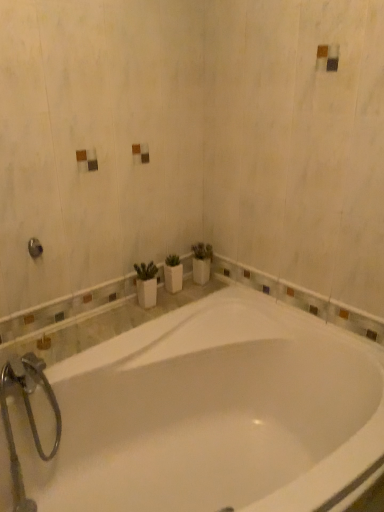
The image size is (384, 512). What do you see at coordinates (35, 248) in the screenshot?
I see `brushed metal shower at upper left` at bounding box center [35, 248].

Measure the distance between brushed metal shower at upper left and camera.

A distance of 1.55 meters exists between brushed metal shower at upper left and camera.

Image resolution: width=384 pixels, height=512 pixels. What are the coordinates of `brushed metal shower at upper left` in the screenshot? It's located at (35, 248).

Describe the element at coordinates (210, 413) in the screenshot. I see `white glossy bathtub at center` at that location.

At what (x,y) coordinates should I click in order to perform the action: click on white glossy bathtub at center. Please return your answer as a coordinate pair (x, y). This screenshot has width=384, height=512. Looking at the image, I should click on (210, 413).

In order to click on brushed metal shower at upper left in this screenshot , I will do `click(35, 248)`.

Consider the image. Considering the positions of objects white glossy bathtub at center and brushed metal shower at upper left in the image provided, who is more to the left, white glossy bathtub at center or brushed metal shower at upper left?

From the viewer's perspective, brushed metal shower at upper left appears more on the left side.

Does white glossy bathtub at center lie behind brushed metal shower at upper left?

No.

Between point (383, 403) and point (33, 256), which one is positioned in front?

The point (383, 403) is in front.

From the image's perspective, is white glossy bathtub at center located above brushed metal shower at upper left?

No, from the image's perspective, white glossy bathtub at center is not above brushed metal shower at upper left.

From a real-world perspective, is white glossy bathtub at center physically located above or below brushed metal shower at upper left?

white glossy bathtub at center is situated lower than brushed metal shower at upper left in the real world.

Between white glossy bathtub at center and brushed metal shower at upper left, which one has smaller width?

brushed metal shower at upper left.

Based on the photo, considering the sizes of white glossy bathtub at center and brushed metal shower at upper left in the image, is white glossy bathtub at center taller or shorter than brushed metal shower at upper left?

Clearly, white glossy bathtub at center is taller compared to brushed metal shower at upper left.

Can you confirm if white glossy bathtub at center is bigger than brushed metal shower at upper left?

Yes.

Can we say white glossy bathtub at center lies outside brushed metal shower at upper left?

Yes, white glossy bathtub at center is not within brushed metal shower at upper left.

From the picture: Is white glossy bathtub at center next to brushed metal shower at upper left?

No, white glossy bathtub at center is not next to brushed metal shower at upper left.

Is white glossy bathtub at center positioned with its back to brushed metal shower at upper left?

No, brushed metal shower at upper left is not at the back of white glossy bathtub at center.

This screenshot has height=512, width=384. Find the location of `bathtub that is in front of the brushed metal shower at upper left`. bathtub that is in front of the brushed metal shower at upper left is located at coordinates (210, 413).

Looking at this image, which is more to the right, brushed metal shower at upper left or white glossy bathtub at center?

white glossy bathtub at center.

Is the depth of brushed metal shower at upper left greater than that of white glossy bathtub at center?

Yes.

Does point (30, 247) appear closer or farther from the camera than point (119, 404)?

Point (30, 247).

From the image's perspective, is brushed metal shower at upper left located beneath white glossy bathtub at center?

Actually, brushed metal shower at upper left appears above white glossy bathtub at center in the image.

From a real-world perspective, is brushed metal shower at upper left positioned over white glossy bathtub at center based on gravity?

Yes.

Between brushed metal shower at upper left and white glossy bathtub at center, which one has larger width?

white glossy bathtub at center is wider.

Is brushed metal shower at upper left taller or shorter than white glossy bathtub at center?

brushed metal shower at upper left is shorter than white glossy bathtub at center.

Is brushed metal shower at upper left bigger or smaller than white glossy bathtub at center?

Considering their sizes, brushed metal shower at upper left takes up less space than white glossy bathtub at center.

Based on the photo, do you think brushed metal shower at upper left is within white glossy bathtub at center, or outside of it?

brushed metal shower at upper left is spatially situated outside white glossy bathtub at center.

Is brushed metal shower at upper left positioned far away from white glossy bathtub at center?

No.

Could you tell me if brushed metal shower at upper left is turned towards white glossy bathtub at center?

No, brushed metal shower at upper left is not aimed at white glossy bathtub at center.

How far apart are brushed metal shower at upper left and white glossy bathtub at center?

brushed metal shower at upper left and white glossy bathtub at center are 35.90 inches apart from each other.

Identify the location of bathtub that appears in front of the brushed metal shower at upper left. Image resolution: width=384 pixels, height=512 pixels. (210, 413).

You are a GUI agent. You are given a task and a screenshot of the screen. Output one action in this format:
    pyautogui.click(x=<x>, y=<y>)
    Task: Click on the shower that is behind the white glossy bathtub at center
    This screenshot has height=512, width=384.
    Given the screenshot: What is the action you would take?
    pyautogui.click(x=35, y=248)

Identify the location of shower located on the left of white glossy bathtub at center. (35, 248).